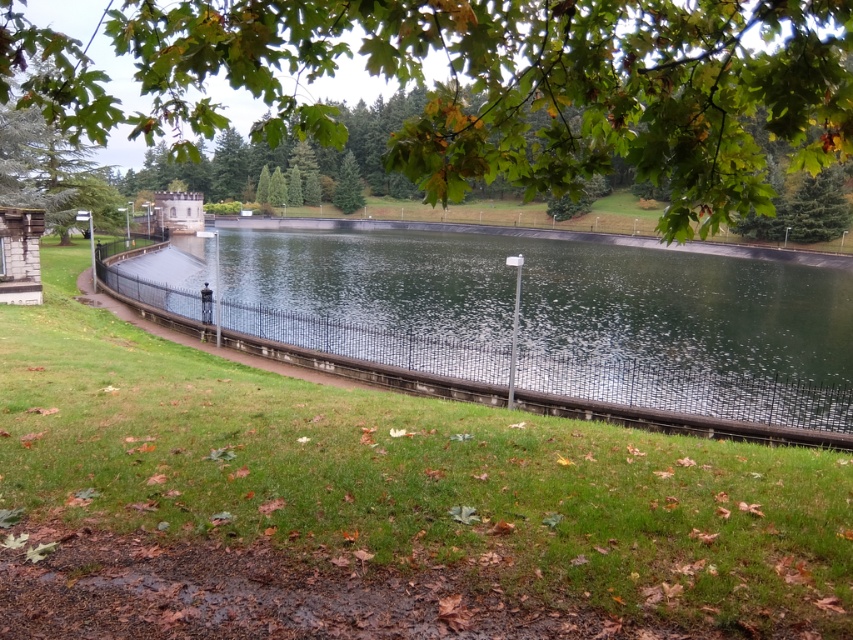
You are a gardener who needs to mow the lawn. You see the green grass at center and the green leafy tree at upper center. Which area should you focus on first if you want to start from the smaller area?

The green grass at center has a smaller size compared to the green leafy tree at upper center, so you should start mowing the green grass at center first.

You are a gardener who wants to mow the green grass at center and trim the green leafy tree at upper center. Which task should you tackle first if you want to start with the shorter object?

The green grass at center is not as tall as the green leafy tree at upper center, so you should mow the green grass at center first since it is shorter.